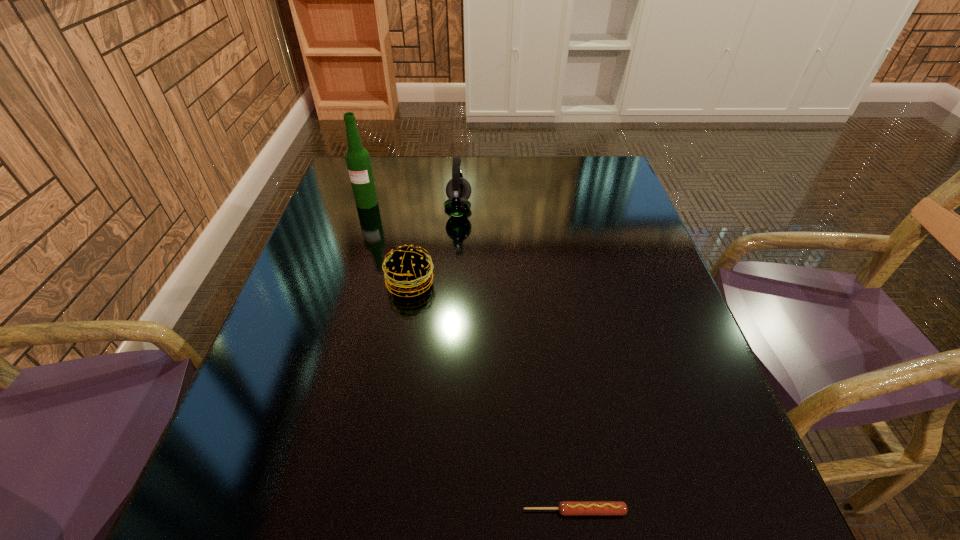
The height and width of the screenshot is (540, 960). I want to click on free space located 0.140m on the back of the third farthest object, so click(x=419, y=230).

The image size is (960, 540). Find the location of `blank space located 0.100m on the left of the sausage`. blank space located 0.100m on the left of the sausage is located at coordinates (457, 511).

This screenshot has width=960, height=540. Find the location of `beer bottle that is at the far edge`. beer bottle that is at the far edge is located at coordinates (357, 158).

Locate an element on the screen. The image size is (960, 540). headset at the far edge is located at coordinates (458, 190).

Find the location of a particular element. This screenshot has height=540, width=960. object that is at the near edge is located at coordinates (566, 508).

The image size is (960, 540). In order to click on object present at the left edge in this screenshot , I will do (357, 158).

Find the location of a particular element. Image resolution: width=960 pixels, height=540 pixels. object present at the far left corner is located at coordinates click(x=357, y=158).

Identify the location of vacant space at the far edge of the desktop. This screenshot has width=960, height=540. (514, 165).

The image size is (960, 540). In the image, there is a desktop. Identify the location of free space at the near edge. (357, 485).

In the image, there is a desktop. Where is `vacant space at the left edge`? This screenshot has width=960, height=540. vacant space at the left edge is located at coordinates (298, 269).